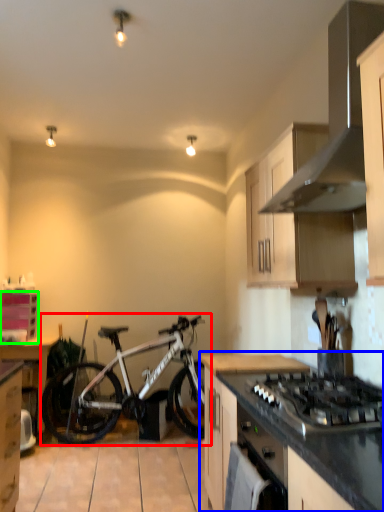
Question: Considering the real-world distances, which object is closest to bicycle (highlighted by a red box)? countertop (highlighted by a blue box) or cabinetry (highlighted by a green box).

Choices:
 (A) countertop
 (B) cabinetry

Answer: (B)